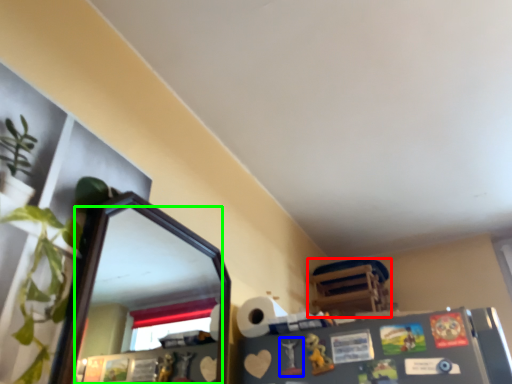
Question: Based on their relative distances, which object is nearer to furniture (highlighted by a red box)? Choose from toy (highlighted by a blue box) and mirror (highlighted by a green box).

Choices:
 (A) toy
 (B) mirror

Answer: (A)